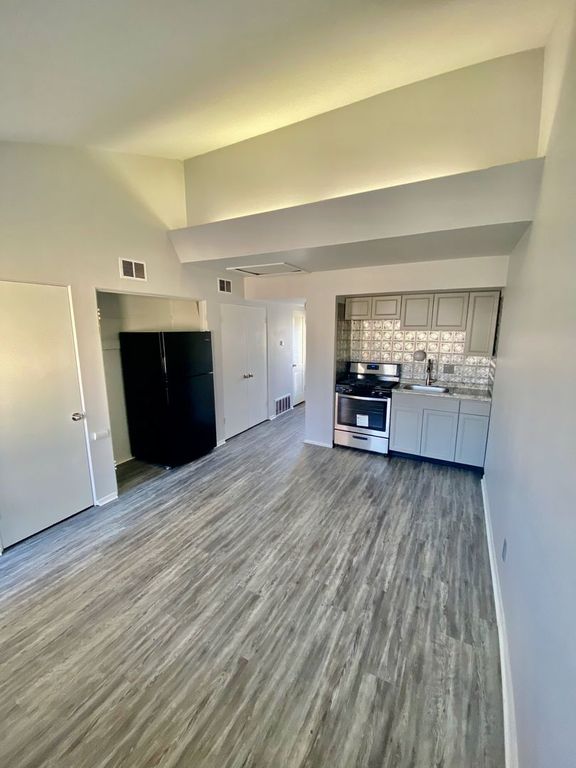
You are a GUI agent. You are given a task and a screenshot of the screen. Output one action in this format:
    pyautogui.click(x=<x>, y=<y>)
    Task: Click on the stove
    Image resolution: width=576 pixels, height=768 pixels.
    Given the screenshot: What is the action you would take?
    pyautogui.click(x=371, y=424)